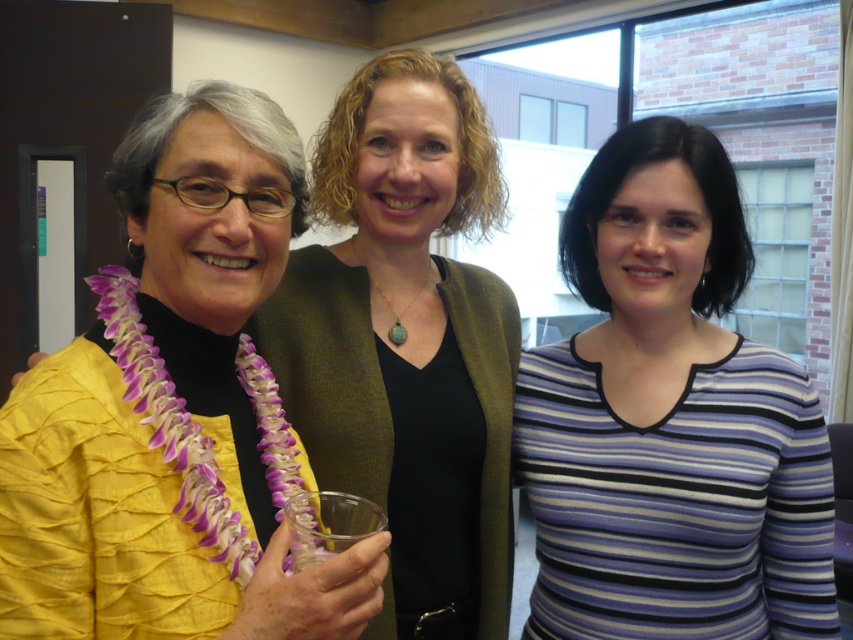
Question: Does striped cotton shirt at center appear on the right side of yellow pleated blouse at left?

Choices:
 (A) yes
 (B) no

Answer: (A)

Question: Is striped cotton shirt at center to the left of yellow pleated blouse at left from the viewer's perspective?

Choices:
 (A) no
 (B) yes

Answer: (A)

Question: Does striped cotton shirt at center have a lesser width compared to yellow pleated blouse at left?

Choices:
 (A) no
 (B) yes

Answer: (A)